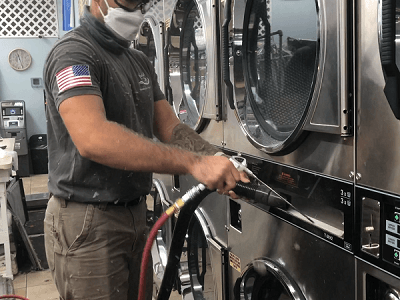
Where is `hinge`? hinge is located at coordinates (350, 128).